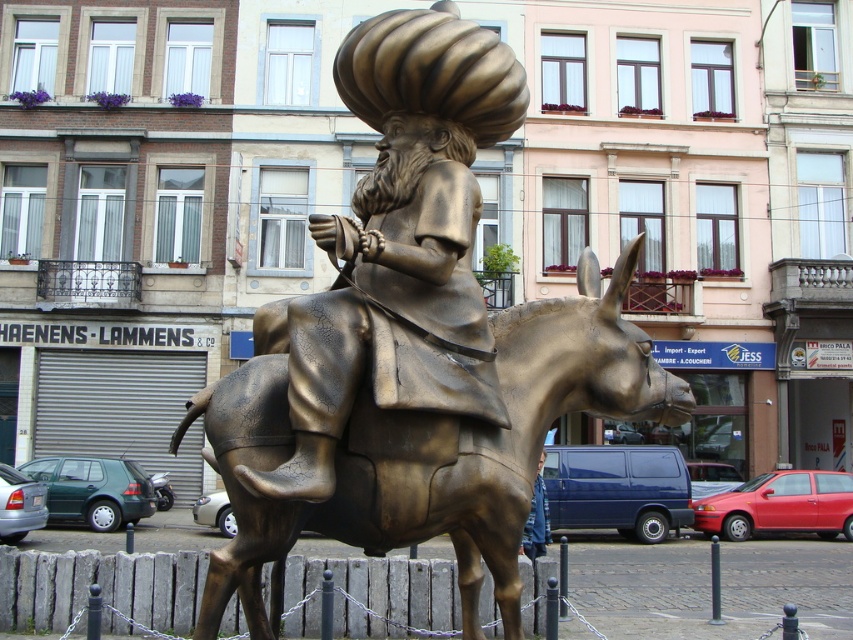
Does bronze statue at center have a greater width compared to bronze textured horse at center?

In fact, bronze statue at center might be narrower than bronze textured horse at center.

Between bronze statue at center and bronze textured horse at center, which one appears on the right side from the viewer's perspective?

bronze textured horse at center

Does point (286, 301) come closer to viewer compared to point (245, 608)?

That is False.

The width and height of the screenshot is (853, 640). What are the coordinates of `bronze statue at center` in the screenshot? It's located at (399, 244).